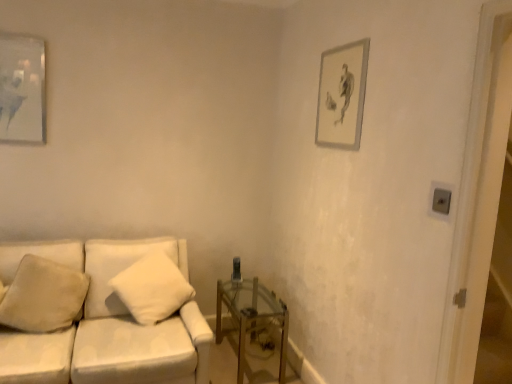
Question: Is matte glass picture frame at upper left, which is counted as the 2th picture frame, starting from the right, wider than matte gray picture frame at upper right, which ranks as the second picture frame in left-to-right order?

Choices:
 (A) yes
 (B) no

Answer: (A)

Question: From the image's perspective, is matte glass picture frame at upper left, the 1th picture frame in the left-to-right sequence, located beneath matte gray picture frame at upper right, which ranks as the second picture frame in left-to-right order?

Choices:
 (A) no
 (B) yes

Answer: (A)

Question: Does matte glass picture frame at upper left, which is counted as the 2th picture frame, starting from the right, appear on the right side of matte gray picture frame at upper right, which ranks as the second picture frame in left-to-right order?

Choices:
 (A) no
 (B) yes

Answer: (A)

Question: Is matte glass picture frame at upper left, which is counted as the 2th picture frame, starting from the right, at the left side of matte gray picture frame at upper right, which ranks as the second picture frame in left-to-right order?

Choices:
 (A) yes
 (B) no

Answer: (A)

Question: From the image's perspective, is matte glass picture frame at upper left, which is counted as the 2th picture frame, starting from the right, over matte gray picture frame at upper right, which ranks as the second picture frame in left-to-right order?

Choices:
 (A) yes
 (B) no

Answer: (A)

Question: Is matte glass picture frame at upper left, which is counted as the 2th picture frame, starting from the right, far away from matte gray picture frame at upper right, which ranks as the second picture frame in left-to-right order?

Choices:
 (A) no
 (B) yes

Answer: (B)

Question: From the image's perspective, does white fabric couch at center appear higher than white soft pillow at center, arranged as the 2th pillow when viewed from the left?

Choices:
 (A) yes
 (B) no

Answer: (B)

Question: Is white fabric couch at center not close to white soft pillow at center, arranged as the 2th pillow when viewed from the left?

Choices:
 (A) no
 (B) yes

Answer: (A)

Question: Is white soft pillow at center, acting as the first pillow starting from the right, completely or partially inside white fabric couch at center?

Choices:
 (A) yes
 (B) no

Answer: (A)

Question: Is white fabric couch at center further to camera compared to white soft pillow at center, arranged as the 2th pillow when viewed from the left?

Choices:
 (A) no
 (B) yes

Answer: (A)

Question: Is white fabric couch at center at the left side of white soft pillow at center, acting as the first pillow starting from the right?

Choices:
 (A) no
 (B) yes

Answer: (B)

Question: Is white soft pillow at center, arranged as the 2th pillow when viewed from the left, at the back of white fabric couch at center?

Choices:
 (A) yes
 (B) no

Answer: (A)

Question: From the image's perspective, is matte gray picture frame at upper right, the first picture frame viewed from the right, under white soft pillow at center, acting as the first pillow starting from the right?

Choices:
 (A) no
 (B) yes

Answer: (A)